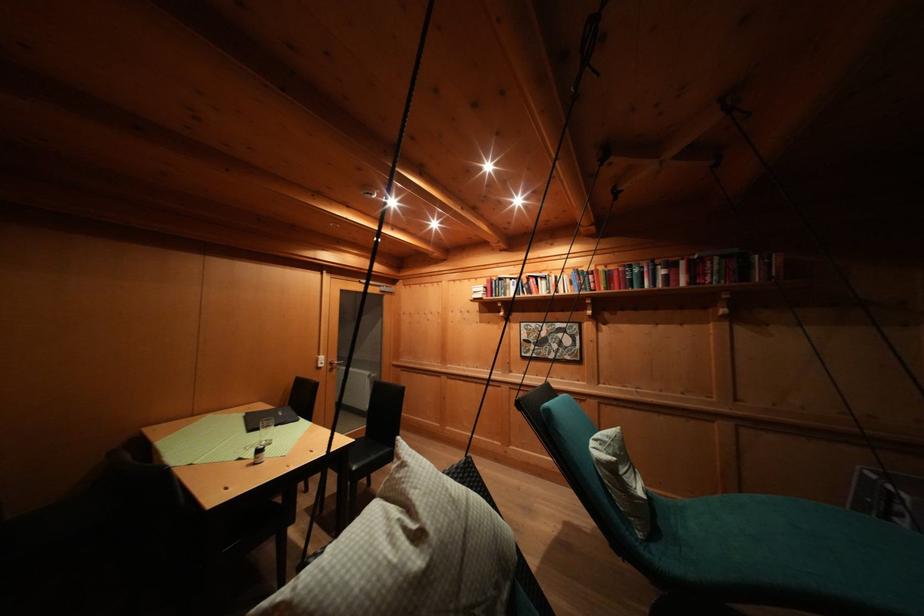
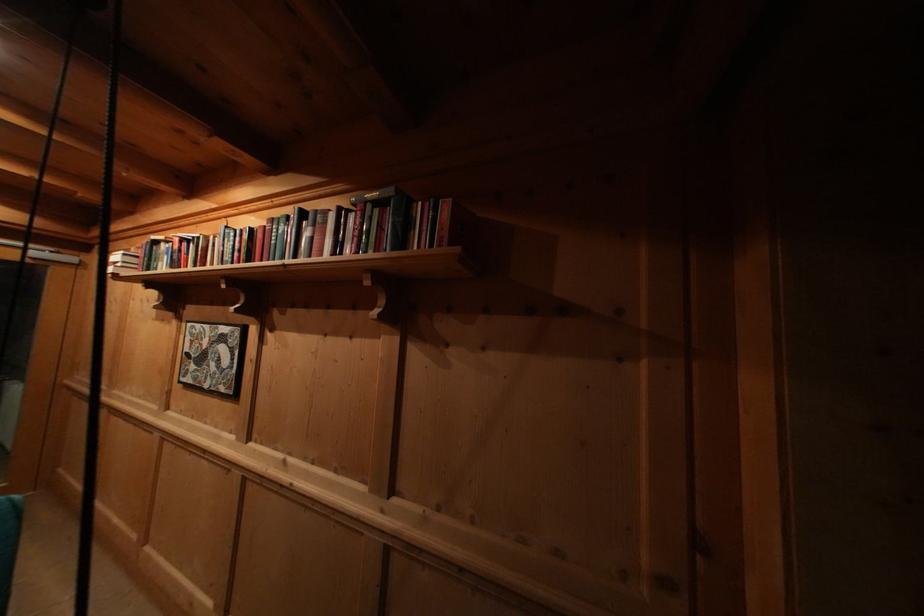
The point at [540,330] is marked in the first image. Where is the corresponding point in the second image?

(204, 331)